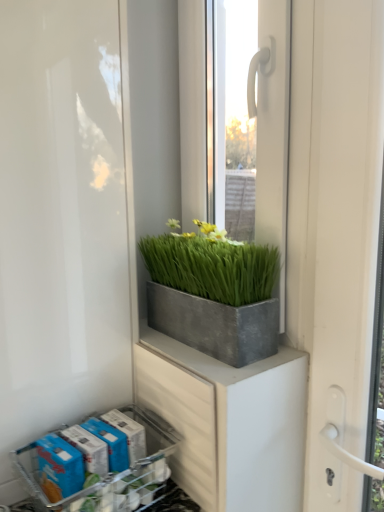
Question: From a real-world perspective, relative to metallic gray flower box at lower left, is white matte screen door at left vertically above or below?

Choices:
 (A) below
 (B) above

Answer: (B)

Question: From the image's perspective, is white matte screen door at left above or below metallic gray flower box at lower left?

Choices:
 (A) above
 (B) below

Answer: (A)

Question: Estimate the real-world distances between objects in this image. Which object is closer to the white matte screen door at left?

Choices:
 (A) clear glass window at center
 (B) metallic gray flower box at lower left

Answer: (B)

Question: Estimate the real-world distances between objects in this image. Which object is closer to the metallic gray flower box at lower left?

Choices:
 (A) clear glass window at center
 (B) white matte screen door at left

Answer: (B)